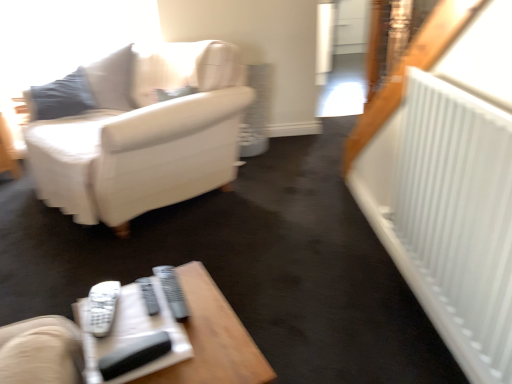
Question: Is gray plastic remote at center, which is the second remote in left-to-right order, thinner than white leather couch at upper left?

Choices:
 (A) no
 (B) yes

Answer: (B)

Question: Would you say gray plastic remote at center, which appears as the first remote when viewed from the right, is outside white leather couch at upper left?

Choices:
 (A) no
 (B) yes

Answer: (B)

Question: Is gray plastic remote at center, which appears as the first remote when viewed from the right, next to white leather couch at upper left and touching it?

Choices:
 (A) no
 (B) yes

Answer: (A)

Question: Is gray plastic remote at center, which is the second remote in left-to-right order, smaller than white leather couch at upper left?

Choices:
 (A) yes
 (B) no

Answer: (A)

Question: Can you confirm if gray plastic remote at center, which is the second remote in left-to-right order, is bigger than white leather couch at upper left?

Choices:
 (A) yes
 (B) no

Answer: (B)

Question: From their relative heights in the image, would you say wooden table at lower center is taller or shorter than gray plastic remote at center, which is the second remote in left-to-right order?

Choices:
 (A) short
 (B) tall

Answer: (B)

Question: From a real-world perspective, relative to gray plastic remote at center, which is the second remote in left-to-right order, is wooden table at lower center vertically above or below?

Choices:
 (A) above
 (B) below

Answer: (B)

Question: Is wooden table at lower center to the left or to the right of gray plastic remote at center, which appears as the first remote when viewed from the right, in the image?

Choices:
 (A) right
 (B) left

Answer: (A)

Question: Is wooden table at lower center spatially inside gray plastic remote at center, which is the second remote in left-to-right order, or outside of it?

Choices:
 (A) outside
 (B) inside

Answer: (A)

Question: From a real-world perspective, is white plastic remote at lower center, which is counted as the 2th remote, starting from the right, physically located above or below white leather couch at upper left?

Choices:
 (A) above
 (B) below

Answer: (A)

Question: Is white plastic remote at lower center, which is counted as the 2th remote, starting from the right, in front of or behind white leather couch at upper left in the image?

Choices:
 (A) behind
 (B) front

Answer: (B)

Question: Is white plastic remote at lower center, the first remote from the left, wider or thinner than white leather couch at upper left?

Choices:
 (A) thin
 (B) wide

Answer: (A)

Question: Is point (113, 314) closer or farther from the camera than point (88, 153)?

Choices:
 (A) closer
 (B) farther

Answer: (A)

Question: From a real-world perspective, is wooden table at lower center positioned above or below white plastic remote at lower center, which is counted as the 2th remote, starting from the right?

Choices:
 (A) above
 (B) below

Answer: (B)

Question: In terms of width, does wooden table at lower center look wider or thinner when compared to white plastic remote at lower center, which is counted as the 2th remote, starting from the right?

Choices:
 (A) thin
 (B) wide

Answer: (B)